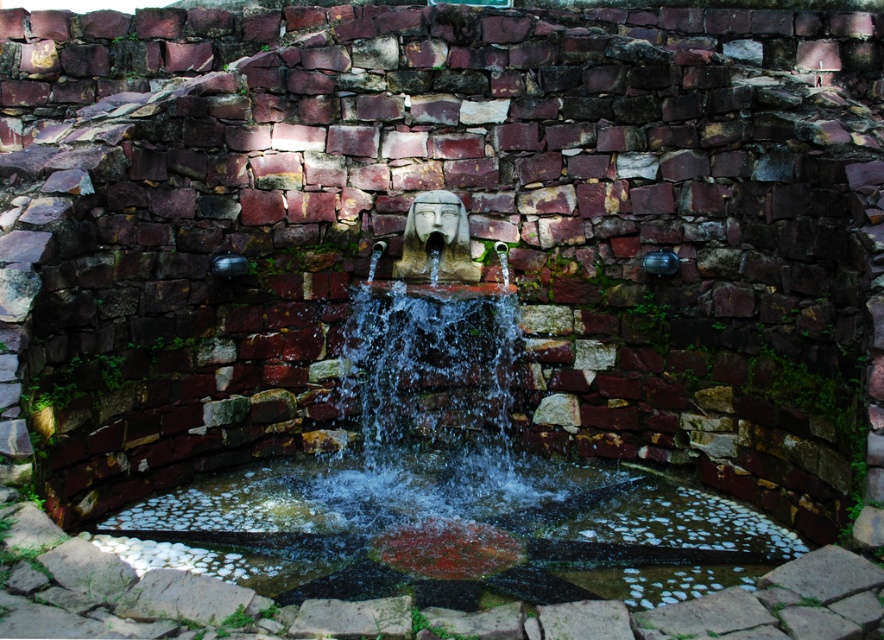
Find the location of a particular element. The image size is (884, 640). stone fountain at center is located at coordinates (448, 490).

Who is positioned more to the right, stone fountain at center or clear water at center?

Positioned to the right is stone fountain at center.

Who is more forward, (532, 513) or (753, 509)?

Point (532, 513) is more forward.

This screenshot has height=640, width=884. Find the location of `stone fountain at center`. stone fountain at center is located at coordinates (448, 490).